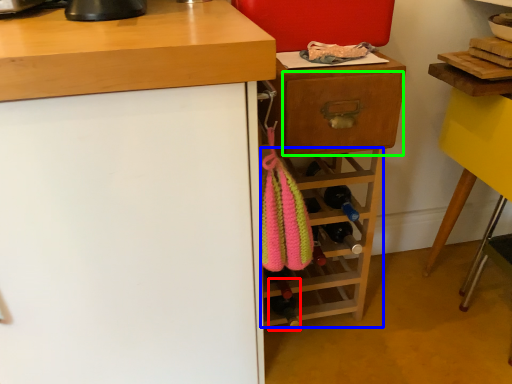
Question: Which object is the closest to the bottle (highlighted by a red box)? Choose among these: shelf (highlighted by a blue box) or drawer (highlighted by a green box).

Choices:
 (A) shelf
 (B) drawer

Answer: (A)